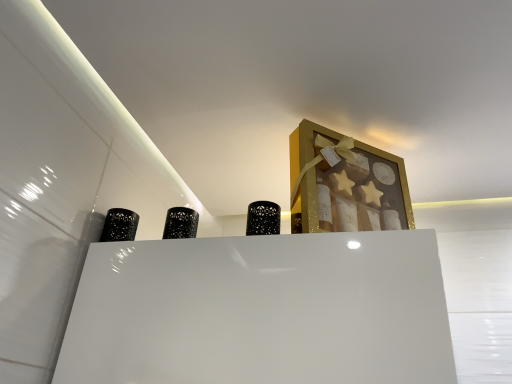
This screenshot has width=512, height=384. What are the coordinates of `free space above gold glitter picture frame at upper center (from a real-world perspective)` in the screenshot? It's located at (350, 130).